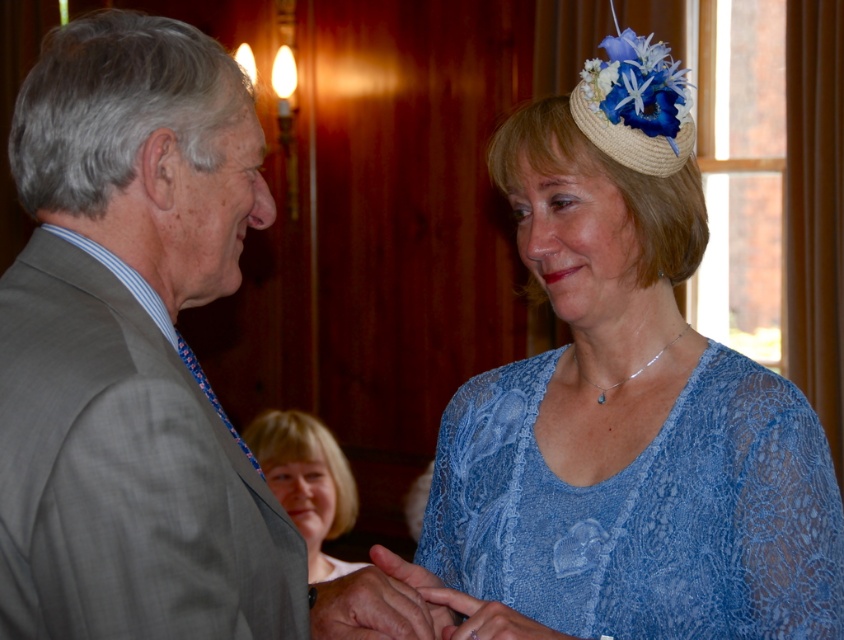
Question: Which point is farther to the camera?

Choices:
 (A) lacy blue dress at center
 (B) smooth skin hand at center

Answer: (A)

Question: Based on their relative distances, which object is nearer to the matte blue lace hand at center?

Choices:
 (A) lacy blue dress at center
 (B) blonde hair at lower center
 (C) smooth skin hand at center

Answer: (C)

Question: Is lacy blue dress at center positioned in front of smooth skin hand at center?

Choices:
 (A) no
 (B) yes

Answer: (A)

Question: In this image, where is lacy blue dress at center located relative to smooth skin hand at center?

Choices:
 (A) right
 (B) left

Answer: (A)

Question: Considering the real-world distances, which object is farthest from the matte blue lace hand at center?

Choices:
 (A) smooth skin hand at center
 (B) blonde hair at lower center
 (C) lacy blue dress at center

Answer: (B)

Question: Does blonde hair at lower center have a greater width compared to smooth skin hand at center?

Choices:
 (A) no
 (B) yes

Answer: (B)